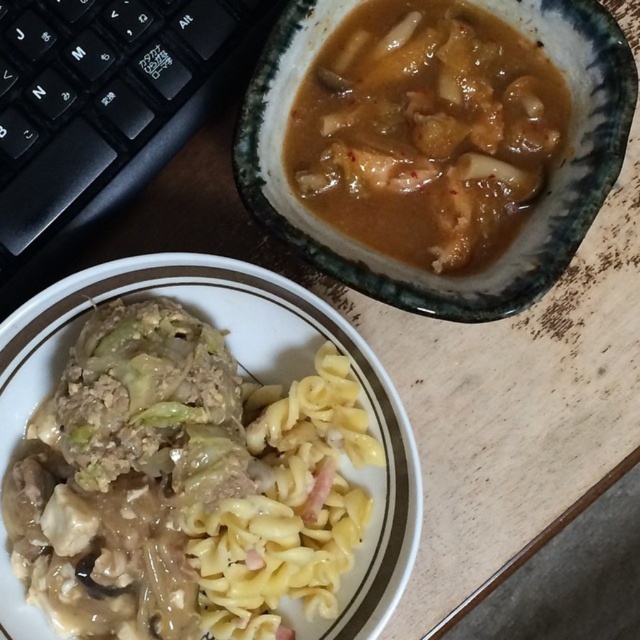
You are a food critic sitting at the table. You need to describe the spatial arrangement of the yellowish matte pasta at lower left and the brown matte stew at upper center. Which one is positioned to the left of the other?

The yellowish matte pasta at lower left is to the left of brown matte stew at upper center.

You are a food critic who needs to take a photo of the meal setup on the wooden table. The brown matte stew at upper center and the yellow matte pasta at center are both in the frame. Since you want to capture the height difference between them, which one should you focus on to ensure it appears taller in the photo?

→ The brown matte stew at upper center is much taller than the yellow matte pasta at center, so focusing on the brown matte stew at upper center will ensure it appears taller in the photo.